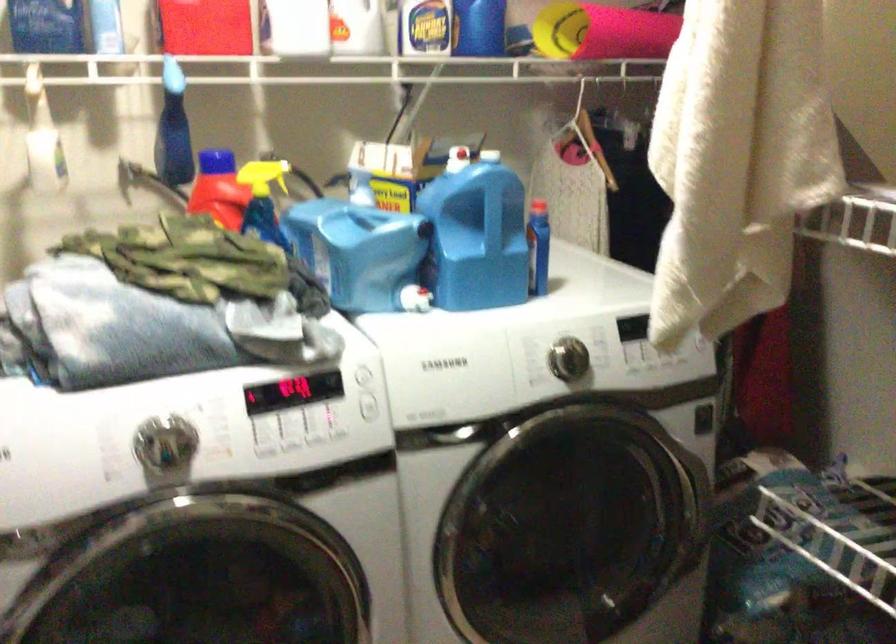
Where would you squeez the white spray bottle trigger? Please return your answer as a coordinate pair (x, y).

(415, 298)